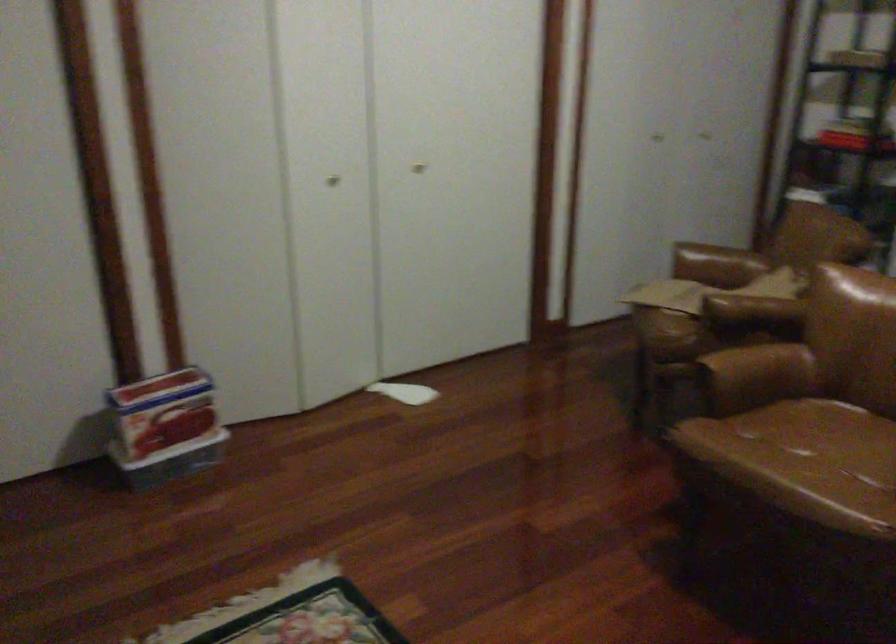
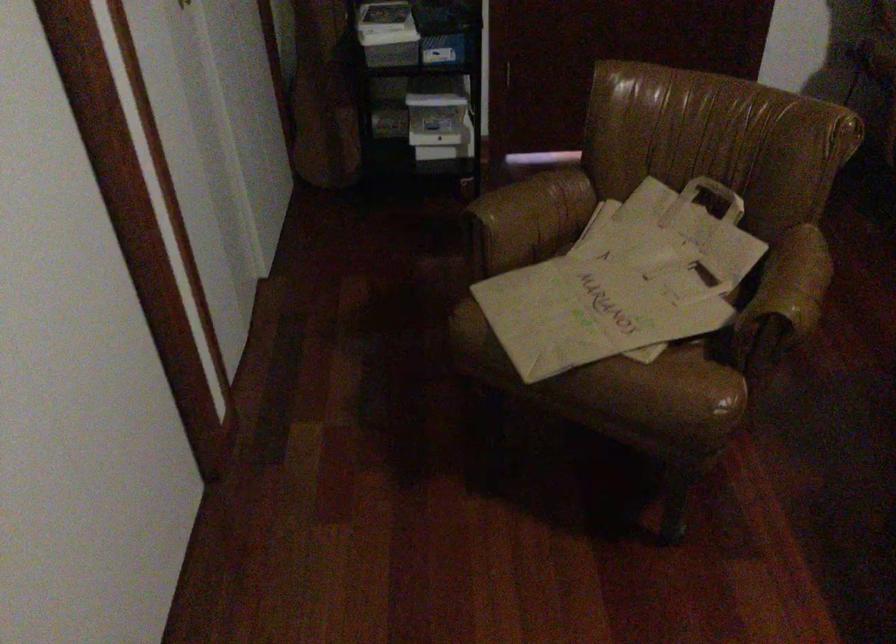
Find the pixel in the second image that matches [807,277] in the first image.

(716, 194)